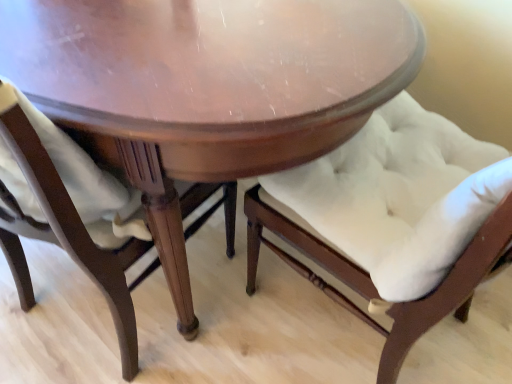
Question: From a real-world perspective, is satin white cushion at lower left, which appears as the first chair when viewed from the left, above or below shiny wood table at center?

Choices:
 (A) above
 (B) below

Answer: (A)

Question: Considering the positions of satin white cushion at lower left, the 2th chair viewed from the right, and shiny wood table at center in the image, is satin white cushion at lower left, the 2th chair viewed from the right, bigger or smaller than shiny wood table at center?

Choices:
 (A) small
 (B) big

Answer: (A)

Question: Which object is positioned closest to the satin white cushion at lower left, which appears as the first chair when viewed from the left?

Choices:
 (A) white tufted cushion at center, arranged as the second chair when viewed from the left
 (B) shiny wood table at center

Answer: (B)

Question: Based on their relative distances, which object is farther from the satin white cushion at lower left, which appears as the first chair when viewed from the left?

Choices:
 (A) white tufted cushion at center, arranged as the second chair when viewed from the left
 (B) shiny wood table at center

Answer: (A)